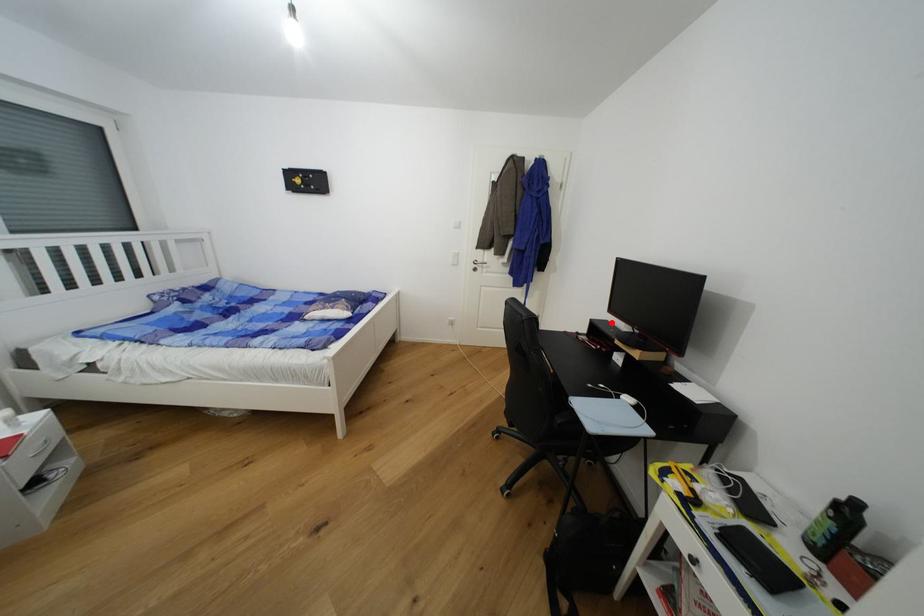
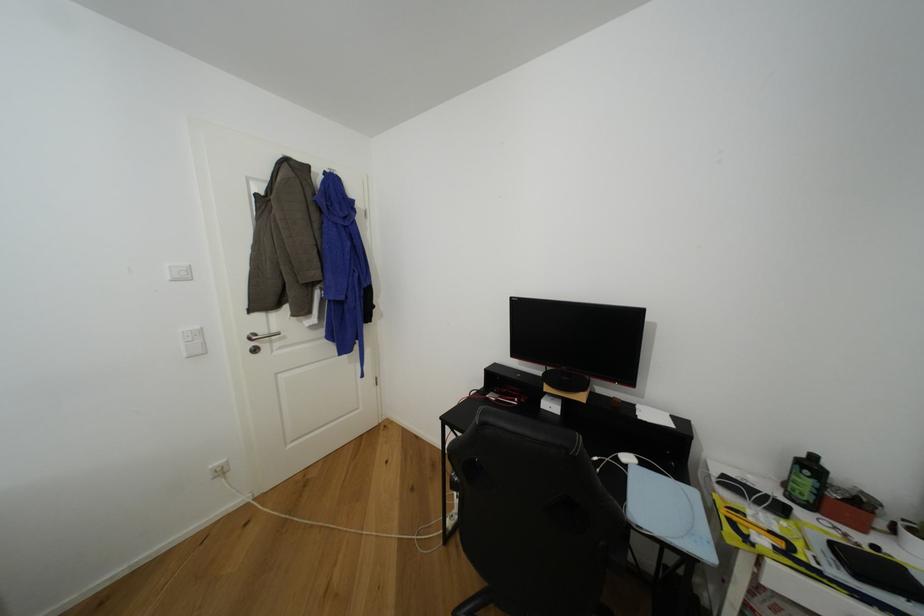
Locate, in the second image, the point that corresponds to the highlighted location in the first image.

(500, 366)